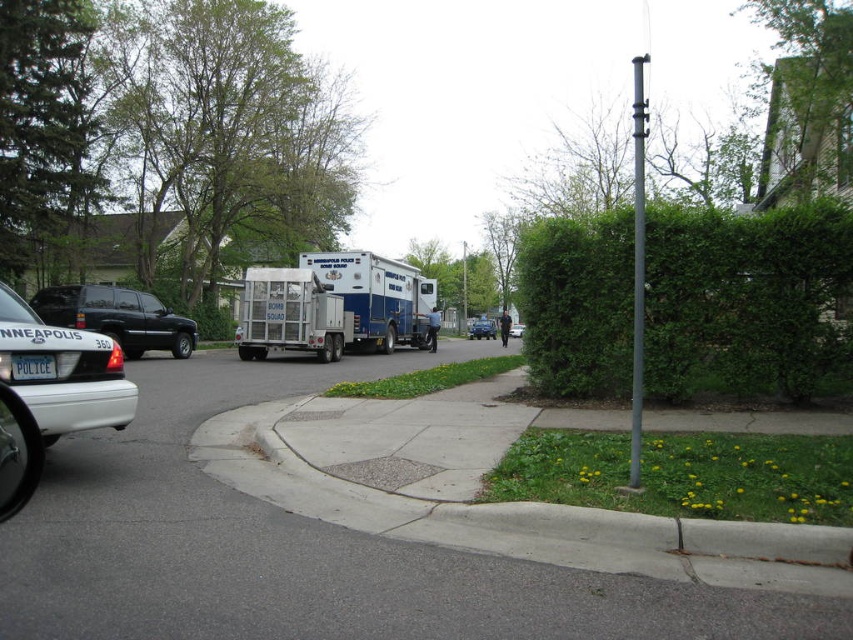
Which is in front, point (180, 406) or point (57, 333)?

Point (57, 333) is in front.

Measure the distance from gray asphalt pavement at center to white matte police car at left.

gray asphalt pavement at center is 4.88 feet away from white matte police car at left.

Who is more forward, (764, 598) or (4, 333)?

Positioned in front is point (764, 598).

The image size is (853, 640). Find the location of `gray asphalt pavement at center`. gray asphalt pavement at center is located at coordinates (300, 552).

Does gray asphalt pavement at center have a smaller size compared to white plastic license plate at center?

No.

Describe the element at coordinates (300, 552) in the screenshot. The image size is (853, 640). I see `gray asphalt pavement at center` at that location.

This screenshot has height=640, width=853. In order to click on gray asphalt pavement at center in this screenshot , I will do `click(300, 552)`.

Is gray asphalt pavement at center behind white glossy sedan at center?

No, gray asphalt pavement at center is in front of white glossy sedan at center.

Is point (235, 378) positioned before point (511, 336)?

Yes, point (235, 378) is closer to viewer.

Which is behind, point (65, 458) or point (514, 333)?

The point (514, 333) is behind.

Find the location of a particular element. Image resolution: width=853 pixels, height=640 pixels. gray asphalt pavement at center is located at coordinates (300, 552).